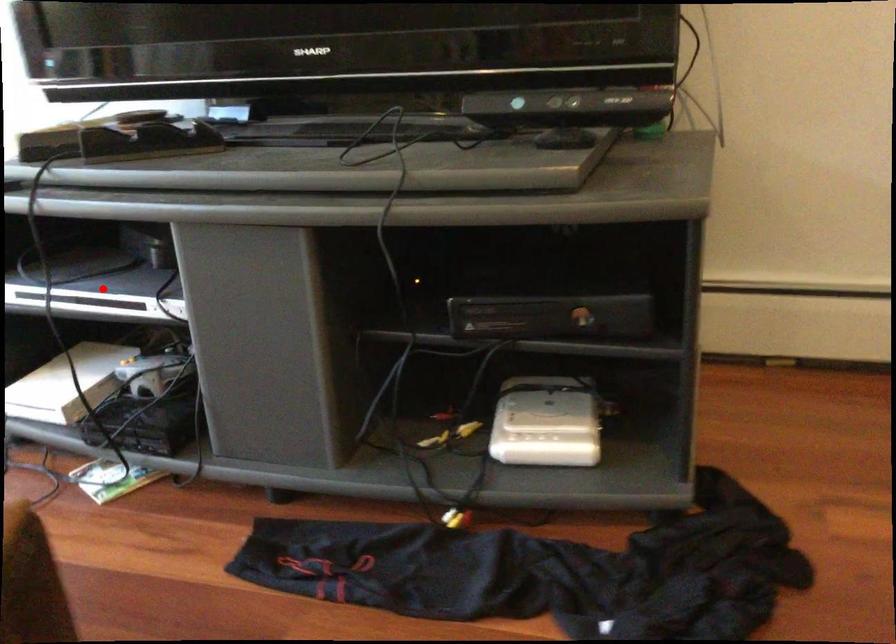
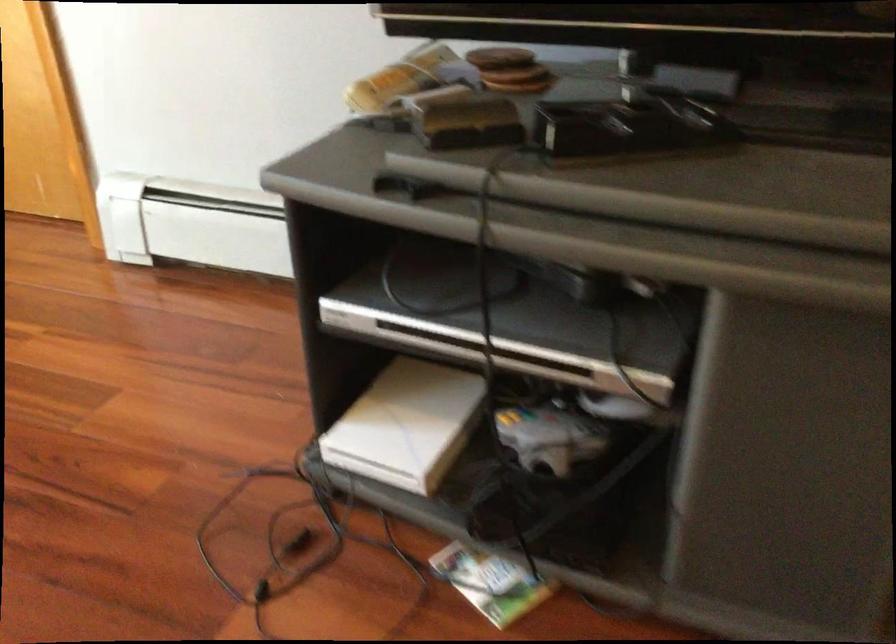
Question: I am providing you with two images of the same scene from different viewpoints. Given a red point in image1, look at the same physical point in image2. Is it:

Choices:
 (A) Closer to the viewpoint
 (B) Farther from the viewpoint

Answer: (A)